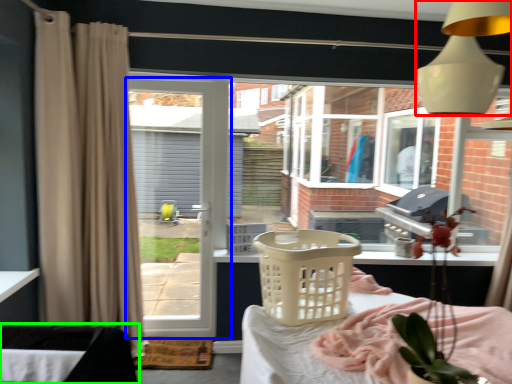
Question: Which object is the farthest from light fixture (highlighted by a red box)? Choose among these: door (highlighted by a blue box) or furniture (highlighted by a green box).

Choices:
 (A) door
 (B) furniture

Answer: (A)